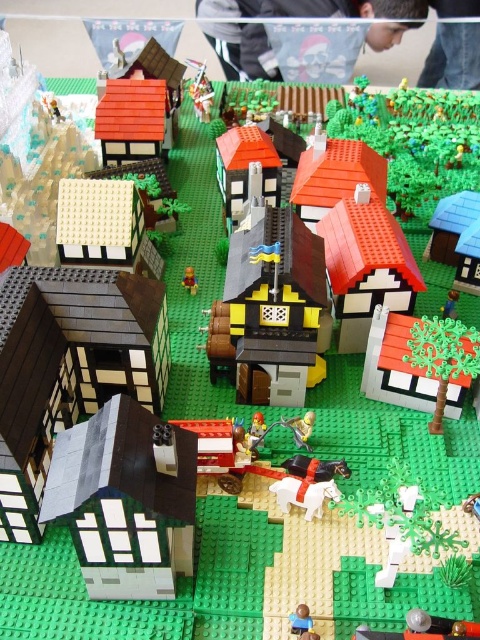
You are a visitor in the Lego village and want to find the smooth yellow minifigure at center. Which direction should you look relative to the matte gray house at lower left?

The matte gray house at lower left is positioned on the left side of the smooth yellow minifigure at center, so you should look to the right of the matte gray house at lower left to find the smooth yellow minifigure at center.

You are standing in the Lego village and want to place a new Lego tree between the two points, point (179, 520) and point (192, 282). Which point should the tree be closer to in order to appear closer to the viewer?

The tree should be placed closer to point (179, 520) because it is closer to the viewer than point (192, 282).